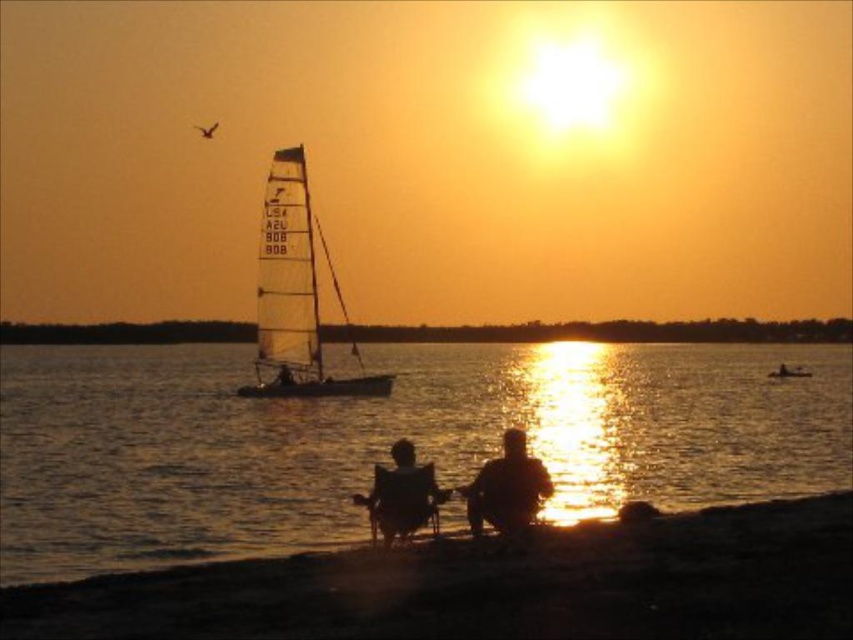
Is dark sand shoreline at lower center further to the viewer compared to smooth orange sky at center?

That is False.

Find the location of `dark sand shoreline at lower center`. dark sand shoreline at lower center is located at coordinates (494, 586).

At what (x,y) coordinates should I click in order to perform the action: click on dark sand shoreline at lower center. Please return your answer as a coordinate pair (x, y). The height and width of the screenshot is (640, 853). Looking at the image, I should click on (494, 586).

Does smooth orange sky at center appear on the left side of metallic silver sailboat at center?

Yes, smooth orange sky at center is to the left of metallic silver sailboat at center.

Which is behind, point (532, 328) or point (807, 369)?

Point (532, 328)

Where is `smooth orange sky at center`? The height and width of the screenshot is (640, 853). smooth orange sky at center is located at coordinates (606, 332).

Between silvery reflective water at center and white translucent sailboat at center, which one appears on the left side from the viewer's perspective?

From the viewer's perspective, white translucent sailboat at center appears more on the left side.

Image resolution: width=853 pixels, height=640 pixels. In order to click on silvery reflective water at center in this screenshot , I will do `click(386, 442)`.